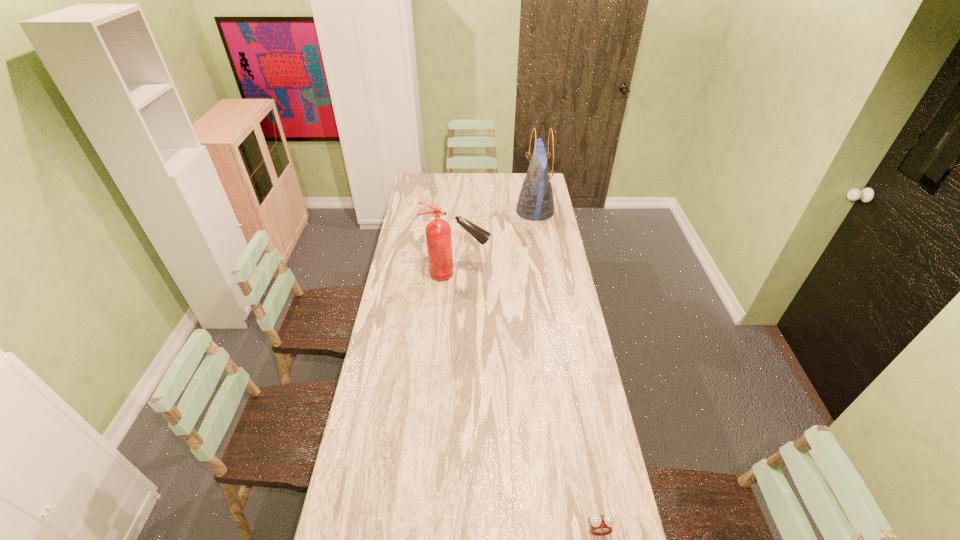
Identify which object is located as the second nearest to the second tallest object. Please provide its 2D coordinates. Your answer should be formatted as a tuple, i.e. [(x, y)], where the tuple contains the x and y coordinates of a point satisfying the conditions above.

[(600, 525)]